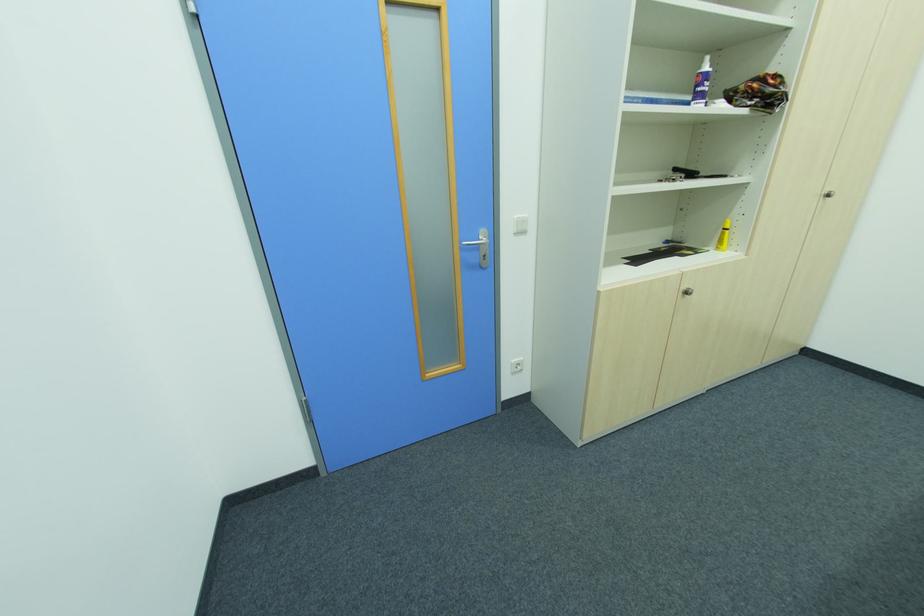
What do you see at coordinates (516, 365) in the screenshot? The height and width of the screenshot is (616, 924). I see `the power outlet socket` at bounding box center [516, 365].